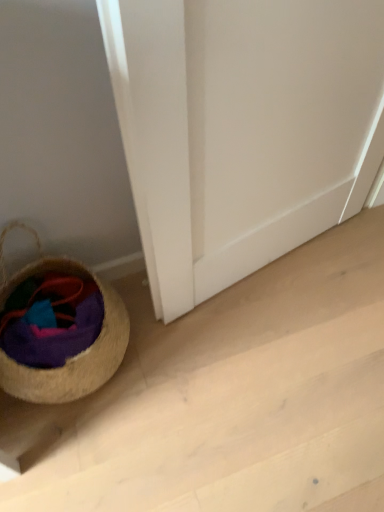
Where is `free location to the right of beige woven basket at lower left`? free location to the right of beige woven basket at lower left is located at coordinates (186, 365).